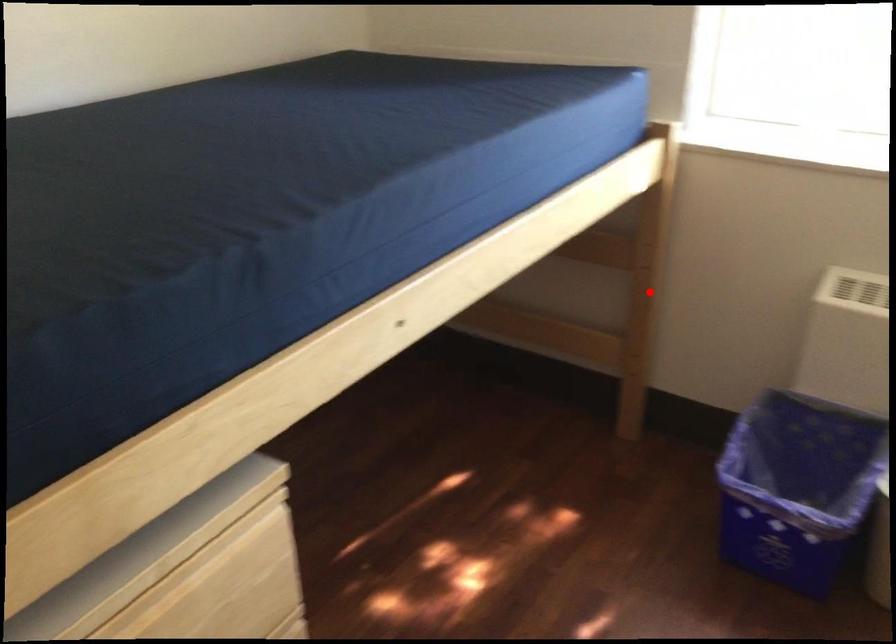
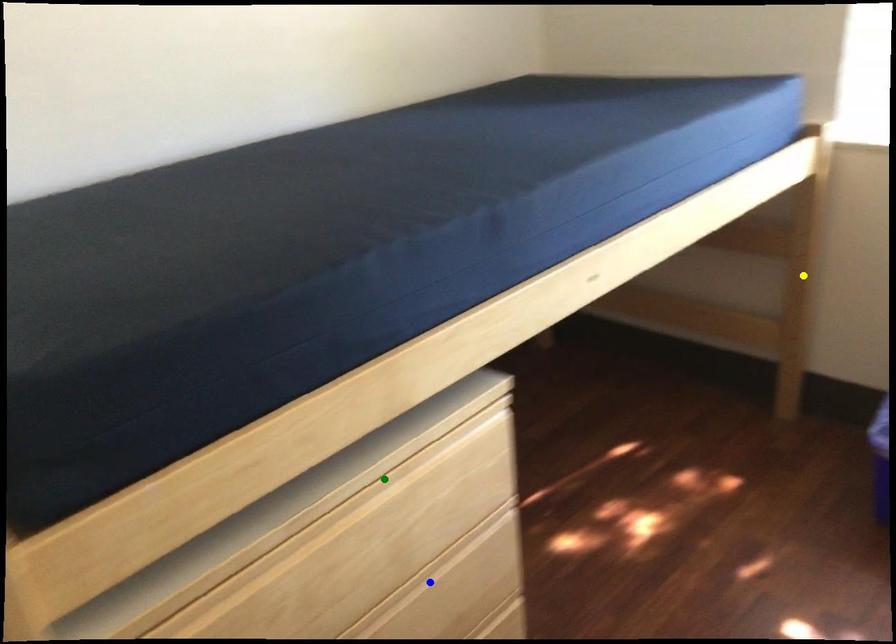
Question: I am providing you with two images of the same scene from different viewpoints. A red point is marked on the first image. You are given multiple points on the second image. Which point in image 2 is actually the same real-world point as the red point in image 1?

Choices:
 (A) blue point
 (B) yellow point
 (C) green point

Answer: (B)